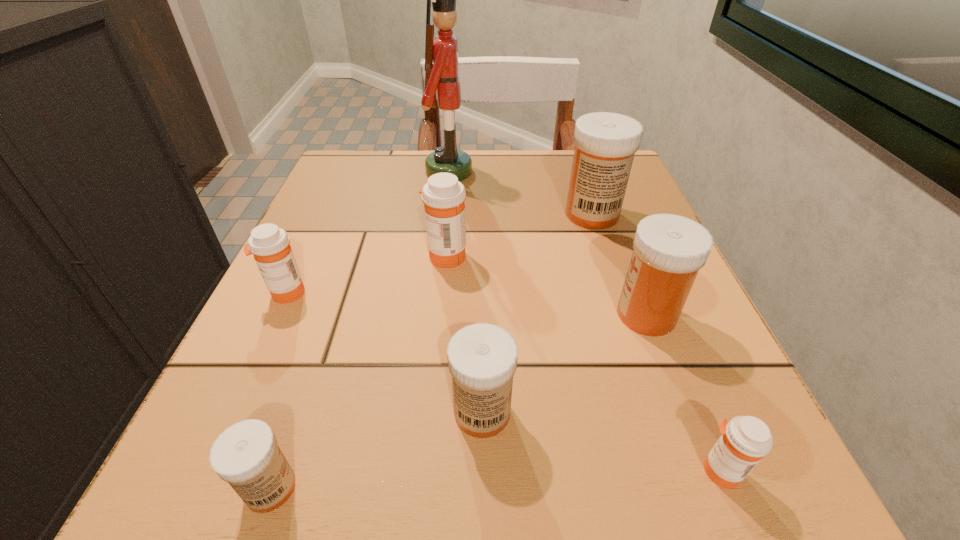
Where is `the tallest object`? Image resolution: width=960 pixels, height=540 pixels. the tallest object is located at coordinates (441, 53).

Identify the location of nutcracker. This screenshot has width=960, height=540. (441, 53).

Identify the location of the tallest medicine. (605, 143).

I want to click on the seventh shortest object, so click(x=605, y=143).

Where is `the biggest orange medicine`? Image resolution: width=960 pixels, height=540 pixels. the biggest orange medicine is located at coordinates (443, 195).

The width and height of the screenshot is (960, 540). I want to click on the sixth nearest medicine, so click(x=443, y=195).

The image size is (960, 540). In order to click on the third nearest white medicine in this screenshot , I will do `click(669, 250)`.

Where is `the leftmost orange medicine`? The image size is (960, 540). the leftmost orange medicine is located at coordinates [x=270, y=245].

Find the location of a particular element. Image resolution: width=960 pixels, height=540 pixels. the second smallest orange medicine is located at coordinates (270, 245).

Find the location of `the fifth farthest medicine`. the fifth farthest medicine is located at coordinates (482, 358).